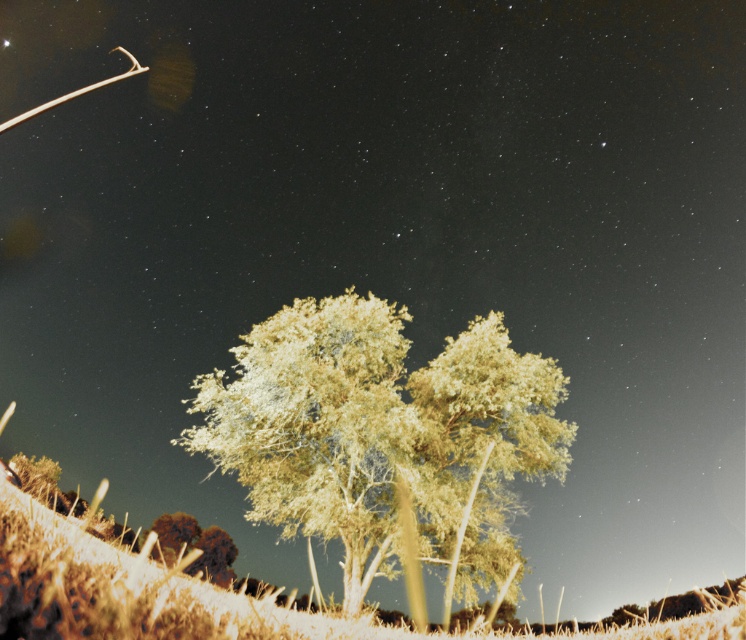
Question: Can you confirm if green leafy tree at center is thinner than brown fuzzy bush at lower left?

Choices:
 (A) no
 (B) yes

Answer: (A)

Question: Which object appears closest to the camera in this image?

Choices:
 (A) brown fuzzy bush at lower left
 (B) green leafy tree at center

Answer: (B)

Question: Which of the following is the farthest from the observer?

Choices:
 (A) (222, 563)
 (B) (357, 308)

Answer: (A)

Question: Can you confirm if green leafy tree at center is positioned to the right of brown fuzzy bush at lower left?

Choices:
 (A) no
 (B) yes

Answer: (B)

Question: Is green leafy tree at center bigger than brown fuzzy bush at lower left?

Choices:
 (A) no
 (B) yes

Answer: (B)

Question: Which of the following is the farthest from the observer?

Choices:
 (A) brown fuzzy bush at lower left
 (B) green leafy tree at center

Answer: (A)